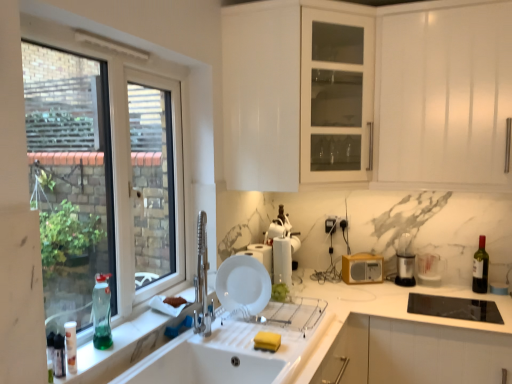
Question: From the image's perspective, does black plastic trash can at right, marked as the 1th appliance in a right-to-left arrangement, appear lower than white plastic container at upper center, marked as the fifth appliance in a right-to-left arrangement?

Choices:
 (A) yes
 (B) no

Answer: (A)

Question: From a real-world perspective, is black plastic trash can at right, the 5th appliance when ordered from left to right, on white plastic container at upper center, the 1th appliance viewed from the left?

Choices:
 (A) yes
 (B) no

Answer: (B)

Question: Can you confirm if black plastic trash can at right, the 5th appliance when ordered from left to right, is taller than white plastic container at upper center, marked as the fifth appliance in a right-to-left arrangement?

Choices:
 (A) yes
 (B) no

Answer: (A)

Question: Considering the relative positions of black plastic trash can at right, the 5th appliance when ordered from left to right, and white plastic container at upper center, the 1th appliance viewed from the left, in the image provided, is black plastic trash can at right, the 5th appliance when ordered from left to right, to the left of white plastic container at upper center, the 1th appliance viewed from the left, from the viewer's perspective?

Choices:
 (A) no
 (B) yes

Answer: (A)

Question: Considering the relative sizes of black plastic trash can at right, the 5th appliance when ordered from left to right, and white plastic container at upper center, marked as the fifth appliance in a right-to-left arrangement, in the image provided, is black plastic trash can at right, the 5th appliance when ordered from left to right, wider than white plastic container at upper center, marked as the fifth appliance in a right-to-left arrangement,?

Choices:
 (A) no
 (B) yes

Answer: (A)

Question: Considering the positions of white glossy kettle at center, which is the 4th appliance from right to left, and white matte plate at sink in the image, is white glossy kettle at center, which is the 4th appliance from right to left, bigger or smaller than white matte plate at sink?

Choices:
 (A) small
 (B) big

Answer: (B)

Question: From a real-world perspective, is white glossy kettle at center, which is the 4th appliance from right to left, physically located above or below white matte plate at sink?

Choices:
 (A) above
 (B) below

Answer: (A)

Question: From the image's perspective, is white glossy kettle at center, which is the 4th appliance from right to left, above or below white matte plate at sink?

Choices:
 (A) below
 (B) above

Answer: (B)

Question: Is point (271, 271) closer or farther from the camera than point (261, 289)?

Choices:
 (A) closer
 (B) farther

Answer: (B)

Question: From a real-world perspective, is dark glass bottle at right, the 3th bottle in the front-to-back sequence, physically located above or below white marble countertop at sink?

Choices:
 (A) above
 (B) below

Answer: (A)

Question: From the image's perspective, is dark glass bottle at right, the 3th bottle in the front-to-back sequence, positioned above or below white marble countertop at sink?

Choices:
 (A) above
 (B) below

Answer: (A)

Question: In terms of size, does dark glass bottle at right, which is counted as the 1th bottle, starting from the right, appear bigger or smaller than white marble countertop at sink?

Choices:
 (A) big
 (B) small

Answer: (B)

Question: Relative to white marble countertop at sink, is dark glass bottle at right, which is the first bottle from back to front, in front or behind?

Choices:
 (A) behind
 (B) front

Answer: (A)

Question: From a real-world perspective, is green glass bottle at window, which ranks as the second bottle in front-to-back order, physically located above or below black plastic trash can at right, the 5th appliance when ordered from left to right?

Choices:
 (A) below
 (B) above

Answer: (B)

Question: Considering the positions of green glass bottle at window, arranged as the second bottle when viewed from the right, and black plastic trash can at right, marked as the 1th appliance in a right-to-left arrangement, in the image, is green glass bottle at window, arranged as the second bottle when viewed from the right, wider or thinner than black plastic trash can at right, marked as the 1th appliance in a right-to-left arrangement,?

Choices:
 (A) wide
 (B) thin

Answer: (B)